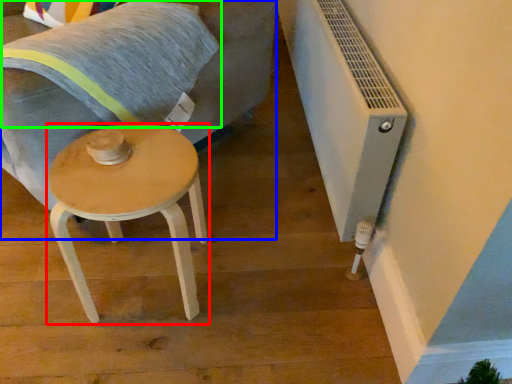
Question: Estimate the real-world distances between objects in this image. Which object is closer to stool (highlighted by a red box), swivel chair (highlighted by a blue box) or pillow (highlighted by a green box)?

Choices:
 (A) swivel chair
 (B) pillow

Answer: (B)